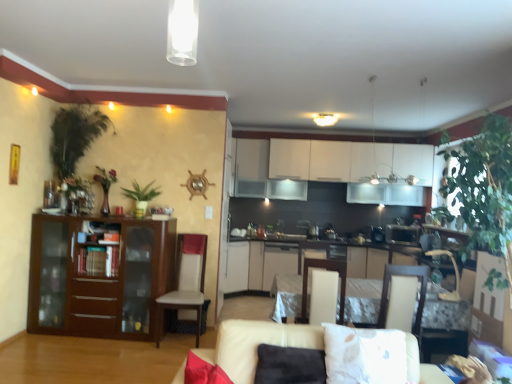
Find the location of a particular element. white cardboard box at lower right is located at coordinates coord(487,303).

What do you see at coordinates (391, 297) in the screenshot?
I see `white fabric armchair at center, the 2th armchair when ordered from left to right` at bounding box center [391, 297].

Measure the distance between point (321,260) and camera.

The depth of point (321,260) is 3.33 meters.

Where is `matte wood cabinet at left, placed as the first cabinetry when sorted from left to right`? The height and width of the screenshot is (384, 512). matte wood cabinet at left, placed as the first cabinetry when sorted from left to right is located at coordinates [98, 276].

Locate an element on the screen. satin gold microwave at center is located at coordinates (402, 234).

What do you see at coordinates (402, 234) in the screenshot? I see `satin gold microwave at center` at bounding box center [402, 234].

Describe the element at coordinates (141, 197) in the screenshot. I see `green matte plant at center-left, acting as the second plant starting from the left` at that location.

How much space does matte white cabinet at center, arranged as the 3th cabinetry when viewed from the front, occupy horizontally?

24.17 inches.

Find the location of `white cardboard box at lower right`. white cardboard box at lower right is located at coordinates pos(487,303).

From a real-world perspective, does green leafy plant at left, placed as the first plant when sorted from left to right, stand above white matte cabinets at upper center, acting as the 2th cabinetry starting from the back?

Actually, green leafy plant at left, placed as the first plant when sorted from left to right, is physically below white matte cabinets at upper center, acting as the 2th cabinetry starting from the back, in the real world.

Which is more to the right, green leafy plant at left, placed as the first plant when sorted from left to right, or white matte cabinets at upper center, the 2th cabinetry positioned from the front?

white matte cabinets at upper center, the 2th cabinetry positioned from the front.

In the scene shown: Is green leafy plant at left, placed as the first plant when sorted from left to right, directly adjacent to white matte cabinets at upper center, the 3th cabinetry viewed from the left?

No, green leafy plant at left, placed as the first plant when sorted from left to right, is not in contact with white matte cabinets at upper center, the 3th cabinetry viewed from the left.

In the scene shown: Which object is wider, green leafy plant at left, which is the second plant from right to left, or white matte cabinets at upper center, the 2th cabinetry positioned from the front?

white matte cabinets at upper center, the 2th cabinetry positioned from the front.

From a real-world perspective, does green matte plant at center-left, the 1th plant from the right, stand above white matte cabinets at upper center, the first cabinetry when ordered from right to left?

No, from a real-world perspective, green matte plant at center-left, the 1th plant from the right, is not above white matte cabinets at upper center, the first cabinetry when ordered from right to left.

Would you consider green matte plant at center-left, the 1th plant from the right, to be distant from white matte cabinets at upper center, the first cabinetry when ordered from right to left?

Yes, green matte plant at center-left, the 1th plant from the right, and white matte cabinets at upper center, the first cabinetry when ordered from right to left, are located far from each other.

From the picture: Which is behind, green matte plant at center-left, the 1th plant from the right, or white matte cabinets at upper center, the 2th cabinetry positioned from the front?

white matte cabinets at upper center, the 2th cabinetry positioned from the front.

In the scene shown: Considering the sizes of green matte plant at center-left, acting as the second plant starting from the left, and white matte cabinets at upper center, the 3th cabinetry viewed from the left, in the image, is green matte plant at center-left, acting as the second plant starting from the left, taller or shorter than white matte cabinets at upper center, the 3th cabinetry viewed from the left,?

green matte plant at center-left, acting as the second plant starting from the left, is shorter than white matte cabinets at upper center, the 3th cabinetry viewed from the left.

From the image's perspective, between white cardboard box at lower right and green matte plant at center-left, acting as the second plant starting from the left, which one is located above?

green matte plant at center-left, acting as the second plant starting from the left, appears higher in the image.

From a real-world perspective, does white cardboard box at lower right sit lower than green matte plant at center-left, the 1th plant from the right?

Indeed, from a real-world perspective, white cardboard box at lower right is positioned beneath green matte plant at center-left, the 1th plant from the right.

How different are the orientations of white cardboard box at lower right and green matte plant at center-left, the 1th plant from the right, in degrees?

The angular difference between white cardboard box at lower right and green matte plant at center-left, the 1th plant from the right, is 179 degrees.

Does white cardboard box at lower right have a smaller size compared to green matte plant at center-left, the 1th plant from the right?

Actually, white cardboard box at lower right might be larger than green matte plant at center-left, the 1th plant from the right.

What are the coordinates of `armchair that is the 3rd object located in front of the white matte cabinets at upper center, the first cabinetry when ordered from right to left` in the screenshot? It's located at (391, 297).

From a real-world perspective, is white matte cabinets at upper center, the first cabinetry when ordered from right to left, above or below white fabric armchair at center, the 2th armchair when ordered from left to right?

Clearly, from a real-world perspective, white matte cabinets at upper center, the first cabinetry when ordered from right to left, is above white fabric armchair at center, the 2th armchair when ordered from left to right.

Is white matte cabinets at upper center, the first cabinetry when ordered from right to left, positioned beyond the bounds of white fabric armchair at center, the second armchair from the right?

white matte cabinets at upper center, the first cabinetry when ordered from right to left, lies outside white fabric armchair at center, the second armchair from the right,'s area.

Is white matte cabinets at upper center, the 2th cabinetry positioned from the front, at the left side of white fabric armchair at center, the 2th armchair when ordered from left to right?

Incorrect, white matte cabinets at upper center, the 2th cabinetry positioned from the front, is not on the left side of white fabric armchair at center, the 2th armchair when ordered from left to right.

Choose the correct answer: Is matte white cabinet at center, arranged as the 3th cabinetry when viewed from the front, inside beige fabric couch at lower center or outside it?

The correct answer is: outside.

From the image's perspective, which one is positioned higher, matte white cabinet at center, positioned as the 2th cabinetry in left-to-right order, or beige fabric couch at lower center?

beige fabric couch at lower center.

Is matte white cabinet at center, arranged as the 3th cabinetry when viewed from the front, shorter than beige fabric couch at lower center?

No.

From the picture: From a real-world perspective, is matte white cabinet at center, which is counted as the second cabinetry, starting from the right, on beige fabric couch at lower center?

Actually, matte white cabinet at center, which is counted as the second cabinetry, starting from the right, is physically below beige fabric couch at lower center in the real world.

Image resolution: width=512 pixels, height=384 pixels. I want to click on plant that is the 1st object located behind the matte wood cabinet at left, which appears as the first cabinetry when viewed from the front, so click(75, 136).

Considering their positions, is matte wood cabinet at left, the third cabinetry positioned from the back, located in front of or behind green leafy plant at left, placed as the first plant when sorted from left to right?

matte wood cabinet at left, the third cabinetry positioned from the back, is in front of green leafy plant at left, placed as the first plant when sorted from left to right.

Is point (116, 258) positioned after point (81, 113)?

No.

Which of these two, matte wood cabinet at left, the third cabinetry positioned from the back, or green leafy plant at left, which is the second plant from right to left, stands taller?

green leafy plant at left, which is the second plant from right to left, is taller.

From the image's perspective, which object appears higher, metallic silver armchair at center, which is counted as the first armchair, starting from the right, or green matte plant at center-left, acting as the second plant starting from the left?

green matte plant at center-left, acting as the second plant starting from the left.

Does metallic silver armchair at center, which is counted as the first armchair, starting from the right, have a lesser height compared to green matte plant at center-left, acting as the second plant starting from the left?

Yes, metallic silver armchair at center, which is counted as the first armchair, starting from the right, is shorter than green matte plant at center-left, acting as the second plant starting from the left.

In terms of size, does metallic silver armchair at center, the third armchair viewed from the left, appear bigger or smaller than green matte plant at center-left, acting as the second plant starting from the left?

In the image, metallic silver armchair at center, the third armchair viewed from the left, appears to be smaller than green matte plant at center-left, acting as the second plant starting from the left.

Is metallic silver armchair at center, the third armchair viewed from the left, in front of or behind green matte plant at center-left, the 1th plant from the right, in the image?

Clearly, metallic silver armchair at center, the third armchair viewed from the left, is in front of green matte plant at center-left, the 1th plant from the right.

From the green leafy plant at left, placed as the first plant when sorted from left to right, count 1st cabinetrys backward and point to it. Please provide its 2D coordinates.

[(339, 169)]

Image resolution: width=512 pixels, height=384 pixels. Identify the location of cabinetry above the green matte plant at center-left, acting as the second plant starting from the left (from the image's perspective). (339, 169).

From the image, which object appears to be nearer to metallic silver armchair at center, which is counted as the first armchair, starting from the right, white fabric armchair at center, the 2th armchair when ordered from left to right, or satin gold microwave at center?

Based on the image, white fabric armchair at center, the 2th armchair when ordered from left to right, appears to be nearer to metallic silver armchair at center, which is counted as the first armchair, starting from the right.

Considering their positions, is white soft pillow at lower center positioned further to beige fabric armchair at center, which appears as the first armchair when viewed from the left, than matte wood cabinet at left, the third cabinetry positioned from the back?

Based on the image, matte wood cabinet at left, the third cabinetry positioned from the back, appears to be further to beige fabric armchair at center, which appears as the first armchair when viewed from the left.

In the scene shown: Considering their positions, is green leafy plant at left, placed as the first plant when sorted from left to right, positioned further to white matte cabinets at upper center, acting as the 2th cabinetry starting from the back, than green matte plant at center-left, acting as the second plant starting from the left?

green leafy plant at left, placed as the first plant when sorted from left to right.

Looking at the image, which one is located further to matte wood cabinet at left, which appears as the first cabinetry when viewed from the front, green matte plant at center-left, acting as the second plant starting from the left, or white cardboard box at lower right?

white cardboard box at lower right is positioned further to the anchor matte wood cabinet at left, which appears as the first cabinetry when viewed from the front.

Looking at the image, which one is located further to white cardboard box at lower right, green matte plant at center-left, the 1th plant from the right, or satin gold microwave at center?

Among the two, green matte plant at center-left, the 1th plant from the right, is located further to white cardboard box at lower right.

Considering their positions, is matte white cabinet at center, arranged as the 3th cabinetry when viewed from the front, positioned closer to white fabric armchair at center, the second armchair from the right, than green matte plant at center-left, the 1th plant from the right?

green matte plant at center-left, the 1th plant from the right, lies closer to white fabric armchair at center, the second armchair from the right, than the other object.

Which object lies nearer to the anchor point green leafy plant at left, which is the second plant from right to left, beige fabric armchair at center, the 3th armchair when ordered from right to left, or satin gold microwave at center?

The object closer to green leafy plant at left, which is the second plant from right to left, is beige fabric armchair at center, the 3th armchair when ordered from right to left.

Based on their spatial positions, is beige fabric armchair at center, the 3th armchair when ordered from right to left, or white matte cabinets at upper center, the 2th cabinetry positioned from the front, further from white cardboard box at lower right?

Based on the image, white matte cabinets at upper center, the 2th cabinetry positioned from the front, appears to be further to white cardboard box at lower right.

Identify the location of armchair situated between matte wood cabinet at left, placed as the third cabinetry when sorted from right to left, and white fabric armchair at center, the 2th armchair when ordered from left to right, from left to right. The image size is (512, 384). (329, 270).

You are a GUI agent. You are given a task and a screenshot of the screen. Output one action in this format:
    pyautogui.click(x=<x>, y=<y>)
    Task: Click on the pillow located between beige fabric couch at lower center and white matte cabinets at upper center, the 3th cabinetry viewed from the left, in the depth direction
    The image size is (512, 384).
    Given the screenshot: What is the action you would take?
    pyautogui.click(x=364, y=355)

Image resolution: width=512 pixels, height=384 pixels. I want to click on pillow between green leafy plant at left, which is the second plant from right to left, and white fabric armchair at center, the 2th armchair when ordered from left to right, so click(x=364, y=355).

This screenshot has width=512, height=384. Identify the location of cabinetry located between white soft pillow at lower center and green matte plant at center-left, the 1th plant from the right, in the depth direction. (98, 276).